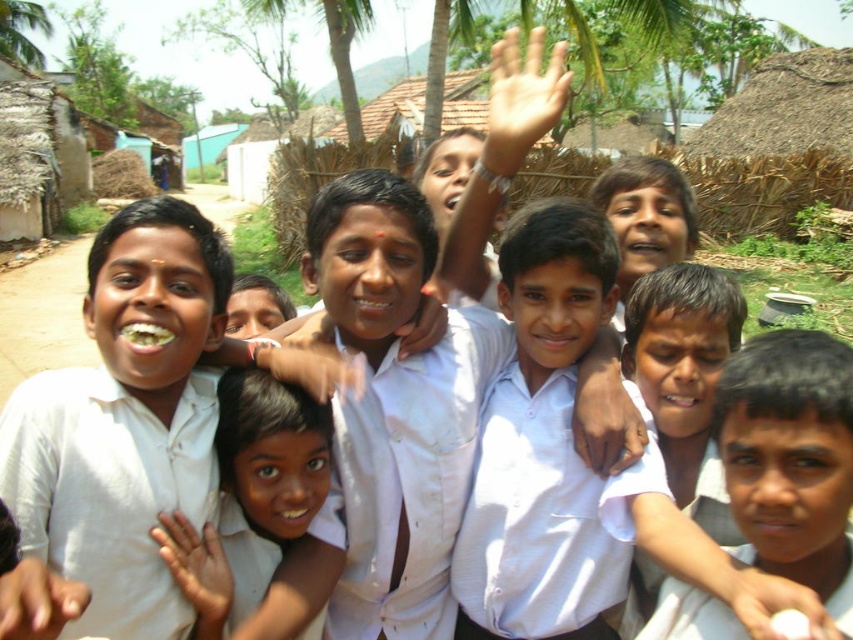
You are a photographer trying to capture a group photo of the children. You notice the white shirt at center and the smooth skin face at center. Which object should you adjust first to ensure proper alignment in the frame?

The white shirt at center is to the right of smooth skin face at center. To ensure proper alignment, you should adjust the smooth skin face at center first so that it is centered before moving the white shirt at center into the correct position.

From the picture: You are a photographer standing at a distance. You want to take a closeup shot of the white matte shirt at center. Based on the scene description, can you determine if you are within the recommended 4 feet distance for a clear closeup?

The distance of white matte shirt at center from camera is 4.15 feet. Since the recommended distance is 4 feet, you are slightly beyond the optimal range for a clear closeup.

You are a photographer trying to capture a group shot of the children. You notice the white glossy shirt at center and the light skin hand at upper center. Which object should you focus on first if you want to ensure both are in focus, given that your camera can only focus on one object at a time?

The white glossy shirt at center is positioned on the left side of light skin hand at upper center. To ensure both are in focus, you should focus on the white glossy shirt at center since it is closer to the camera than the light skin hand at upper center.